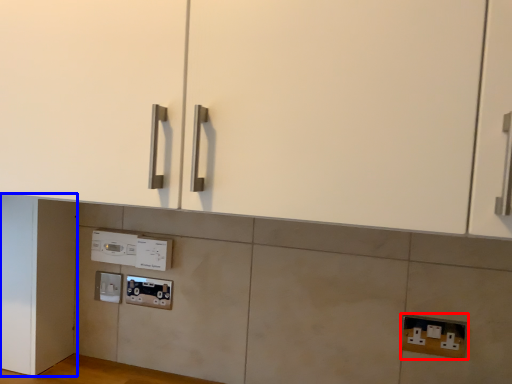
Question: Which object is further to the camera taking this photo, electric outlet (highlighted by a red box) or door (highlighted by a blue box)?

Choices:
 (A) electric outlet
 (B) door

Answer: (B)